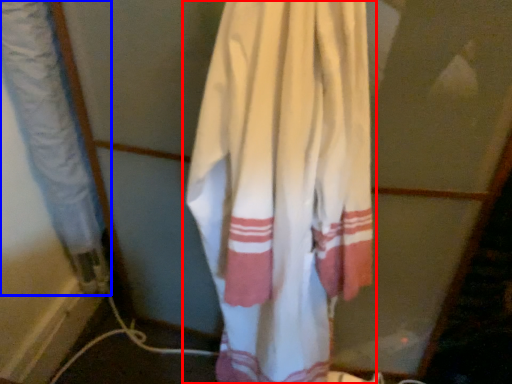
Question: Among these objects, which one is farthest to the camera, curtain (highlighted by a red box) or curtain (highlighted by a blue box)?

Choices:
 (A) curtain
 (B) curtain

Answer: (B)